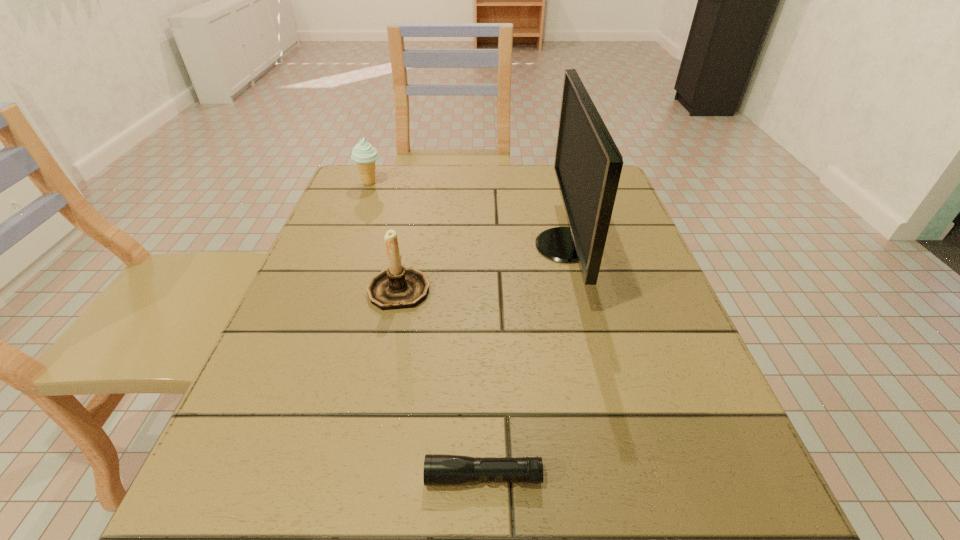
Locate an element on the screen. The image size is (960, 540). the tallest object is located at coordinates (588, 164).

You are a GUI agent. You are given a task and a screenshot of the screen. Output one action in this format:
    pyautogui.click(x=<x>, y=<y>)
    Task: Click on the rightmost object
    
    Given the screenshot: What is the action you would take?
    pyautogui.click(x=588, y=164)

Identify the location of the second tallest object. This screenshot has height=540, width=960. (397, 287).

The width and height of the screenshot is (960, 540). Find the location of `the second object from left to right`. the second object from left to right is located at coordinates (397, 287).

Where is `the farthest object`? This screenshot has width=960, height=540. the farthest object is located at coordinates (363, 153).

Image resolution: width=960 pixels, height=540 pixels. Identify the location of the second shortest object. pyautogui.click(x=363, y=153).

Locate an element on the screen. This screenshot has height=540, width=960. the third object from left to right is located at coordinates (439, 469).

The width and height of the screenshot is (960, 540). I want to click on the shortest object, so click(x=439, y=469).

The image size is (960, 540). Find the location of `free space located on the front-facing side of the rightmost object`. free space located on the front-facing side of the rightmost object is located at coordinates (367, 246).

Find the location of `free space located on the front-facing side of the rightmost object`. free space located on the front-facing side of the rightmost object is located at coordinates (493, 246).